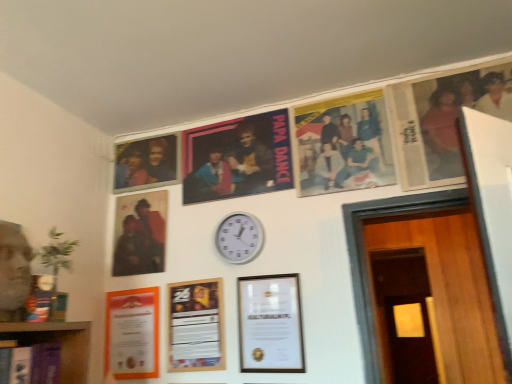
Question: Is wooden door at lower right directly adjacent to printed paper poster at upper center, which ranks as the 2th poster in left-to-right order?

Choices:
 (A) no
 (B) yes

Answer: (A)

Question: Considering the relative positions of wooden door at lower right and printed paper poster at upper center, marked as the 1th poster in a right-to-left arrangement, in the image provided, is wooden door at lower right to the left of printed paper poster at upper center, marked as the 1th poster in a right-to-left arrangement, from the viewer's perspective?

Choices:
 (A) no
 (B) yes

Answer: (A)

Question: Considering the relative sizes of wooden door at lower right and printed paper poster at upper center, marked as the 1th poster in a right-to-left arrangement, in the image provided, is wooden door at lower right thinner than printed paper poster at upper center, marked as the 1th poster in a right-to-left arrangement,?

Choices:
 (A) no
 (B) yes

Answer: (A)

Question: From the image's perspective, is wooden door at lower right located beneath printed paper poster at upper center, marked as the 1th poster in a right-to-left arrangement?

Choices:
 (A) yes
 (B) no

Answer: (A)

Question: Does wooden door at lower right have a greater height compared to printed paper poster at upper center, marked as the 1th poster in a right-to-left arrangement?

Choices:
 (A) no
 (B) yes

Answer: (B)

Question: Considering the positions of wooden door at lower right and matte orange certificate at lower left, the 5th picture frame in the right-to-left sequence, in the image, is wooden door at lower right wider or thinner than matte orange certificate at lower left, the 5th picture frame in the right-to-left sequence,?

Choices:
 (A) thin
 (B) wide

Answer: (B)

Question: Is wooden door at lower right situated inside matte orange certificate at lower left, which is the 2th picture frame from left to right, or outside?

Choices:
 (A) inside
 (B) outside

Answer: (B)

Question: From a real-world perspective, is wooden door at lower right positioned above or below matte orange certificate at lower left, the 5th picture frame in the right-to-left sequence?

Choices:
 (A) above
 (B) below

Answer: (B)

Question: Is point pos(415,362) closer or farther from the camera than point pos(139,342)?

Choices:
 (A) closer
 (B) farther

Answer: (B)

Question: Does point (334, 110) appear closer or farther from the camera than point (504, 99)?

Choices:
 (A) closer
 (B) farther

Answer: (B)

Question: Considering the positions of printed paper poster at upper center, marked as the 1th poster in a right-to-left arrangement, and matte plastic photo frame at upper right, which is the first picture frame from right to left, in the image, is printed paper poster at upper center, marked as the 1th poster in a right-to-left arrangement, bigger or smaller than matte plastic photo frame at upper right, which is the first picture frame from right to left,?

Choices:
 (A) big
 (B) small

Answer: (B)

Question: Relative to matte plastic photo frame at upper right, which is the first picture frame from right to left, is printed paper poster at upper center, marked as the 1th poster in a right-to-left arrangement, in front or behind?

Choices:
 (A) front
 (B) behind

Answer: (B)

Question: Considering the positions of printed paper poster at upper center, which ranks as the 2th poster in left-to-right order, and matte plastic photo frame at upper right, arranged as the sixth picture frame when viewed from the left, in the image, is printed paper poster at upper center, which ranks as the 2th poster in left-to-right order, wider or thinner than matte plastic photo frame at upper right, arranged as the sixth picture frame when viewed from the left,?

Choices:
 (A) thin
 (B) wide

Answer: (B)

Question: Looking at the image, does wooden door at lower right seem bigger or smaller compared to matte plastic photo frame at upper left, which ranks as the third picture frame in left-to-right order?

Choices:
 (A) small
 (B) big

Answer: (B)

Question: Visually, is wooden door at lower right positioned to the left or to the right of matte plastic photo frame at upper left, the 4th picture frame positioned from the right?

Choices:
 (A) right
 (B) left

Answer: (A)